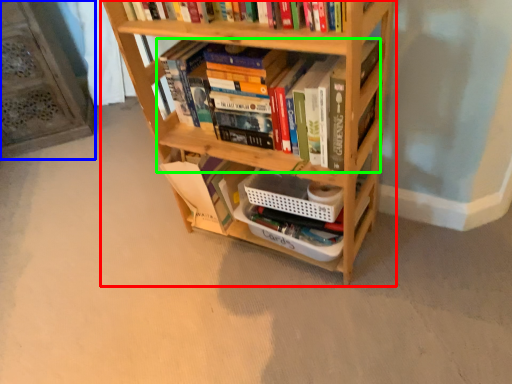
Question: Estimate the real-world distances between objects in this image. Which object is farther from bookcase (highlighted by a red box), shelf (highlighted by a blue box) or book (highlighted by a green box)?

Choices:
 (A) shelf
 (B) book

Answer: (A)